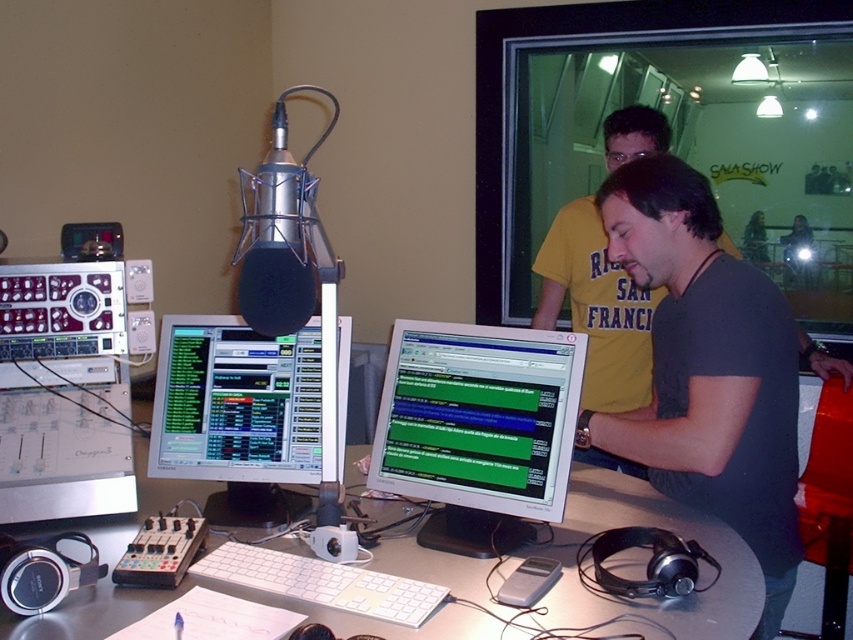
Does white glossy monitor at center appear on the right side of matte black monitor at center?

Indeed, white glossy monitor at center is positioned on the right side of matte black monitor at center.

Does white glossy monitor at center appear under matte black monitor at center?

Correct, white glossy monitor at center is located below matte black monitor at center.

Image resolution: width=853 pixels, height=640 pixels. I want to click on white glossy monitor at center, so click(479, 429).

You are a GUI agent. You are given a task and a screenshot of the screen. Output one action in this format:
    pyautogui.click(x=<x>, y=<y>)
    Task: Click on the white glossy monitor at center
    The image size is (853, 640).
    Given the screenshot: What is the action you would take?
    pyautogui.click(x=479, y=429)

What are the coordinates of `black matte shirt at center` in the screenshot? It's located at click(706, 371).

Does black matte shirt at center appear over silver metallic desk at center?

Correct, black matte shirt at center is located above silver metallic desk at center.

I want to click on black matte shirt at center, so click(706, 371).

This screenshot has height=640, width=853. I want to click on black matte shirt at center, so click(706, 371).

Which of these two, matte black monitor at center or matte black microphone at center, stands taller?

matte black monitor at center is taller.

Which is more to the right, matte black monitor at center or matte black microphone at center?

From the viewer's perspective, matte black microphone at center appears more on the right side.

Locate an element on the screen. This screenshot has width=853, height=640. matte black monitor at center is located at coordinates (238, 416).